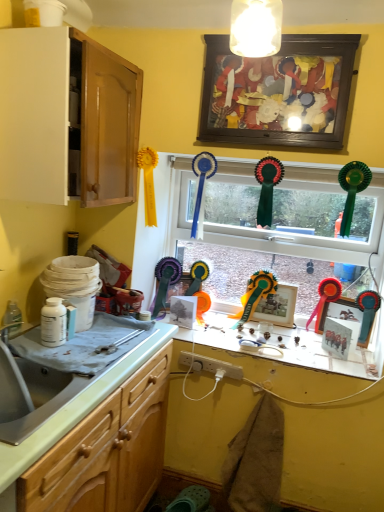
Question: Is metallic silver picture frame at right, the 4th picture frame when ordered from top to bottom, wider than wooden picture frame at upper center, marked as the 5th picture frame in a bottom-to-top arrangement?

Choices:
 (A) yes
 (B) no

Answer: (B)

Question: Is metallic silver picture frame at right, which is the second picture frame in bottom-to-top order, positioned in front of wooden picture frame at upper center, marked as the 5th picture frame in a bottom-to-top arrangement?

Choices:
 (A) yes
 (B) no

Answer: (B)

Question: Is metallic silver picture frame at right, which is the second picture frame in bottom-to-top order, aimed at wooden picture frame at upper center, marked as the 5th picture frame in a bottom-to-top arrangement?

Choices:
 (A) no
 (B) yes

Answer: (A)

Question: Does metallic silver picture frame at right, which is the second picture frame in bottom-to-top order, come behind wooden picture frame at upper center, which ranks as the first picture frame in top-to-bottom order?

Choices:
 (A) yes
 (B) no

Answer: (A)

Question: Does metallic silver picture frame at right, the 4th picture frame when ordered from top to bottom, appear on the left side of wooden picture frame at upper center, marked as the 5th picture frame in a bottom-to-top arrangement?

Choices:
 (A) yes
 (B) no

Answer: (B)

Question: Which is correct: matte paper picture frame at center, the third picture frame in the bottom-to-top sequence, is inside metallic silver picture frame at right, the 4th picture frame when ordered from top to bottom, or outside of it?

Choices:
 (A) inside
 (B) outside

Answer: (B)

Question: Considering the positions of matte paper picture frame at center, which ranks as the 3th picture frame in top-to-bottom order, and metallic silver picture frame at right, the 4th picture frame when ordered from top to bottom, in the image, is matte paper picture frame at center, which ranks as the 3th picture frame in top-to-bottom order, wider or thinner than metallic silver picture frame at right, the 4th picture frame when ordered from top to bottom,?

Choices:
 (A) wide
 (B) thin

Answer: (A)

Question: Is point (182, 311) closer or farther from the camera than point (342, 305)?

Choices:
 (A) farther
 (B) closer

Answer: (A)

Question: Is matte paper picture frame at center, the third picture frame in the bottom-to-top sequence, in front of or behind metallic silver picture frame at right, the 4th picture frame when ordered from top to bottom, in the image?

Choices:
 (A) front
 (B) behind

Answer: (B)

Question: From the image's perspective, is silver metallic sink at lower left located above or below metallic silver picture frame at right, the fifth picture frame in the top-to-bottom sequence?

Choices:
 (A) below
 (B) above

Answer: (B)

Question: From a real-world perspective, is silver metallic sink at lower left above or below metallic silver picture frame at right, which is the first picture frame from bottom to top?

Choices:
 (A) above
 (B) below

Answer: (A)

Question: Does point (76, 394) appear closer or farther from the camera than point (327, 322)?

Choices:
 (A) closer
 (B) farther

Answer: (A)

Question: Considering their positions, is silver metallic sink at lower left located in front of or behind metallic silver picture frame at right, the fifth picture frame in the top-to-bottom sequence?

Choices:
 (A) behind
 (B) front

Answer: (B)

Question: In the image, is metallic silver picture frame at right, the fifth picture frame in the top-to-bottom sequence, on the left side or the right side of wooden picture frame at upper center, which ranks as the first picture frame in top-to-bottom order?

Choices:
 (A) right
 (B) left

Answer: (A)

Question: Which is correct: metallic silver picture frame at right, which is the first picture frame from bottom to top, is inside wooden picture frame at upper center, marked as the 5th picture frame in a bottom-to-top arrangement, or outside of it?

Choices:
 (A) outside
 (B) inside

Answer: (A)